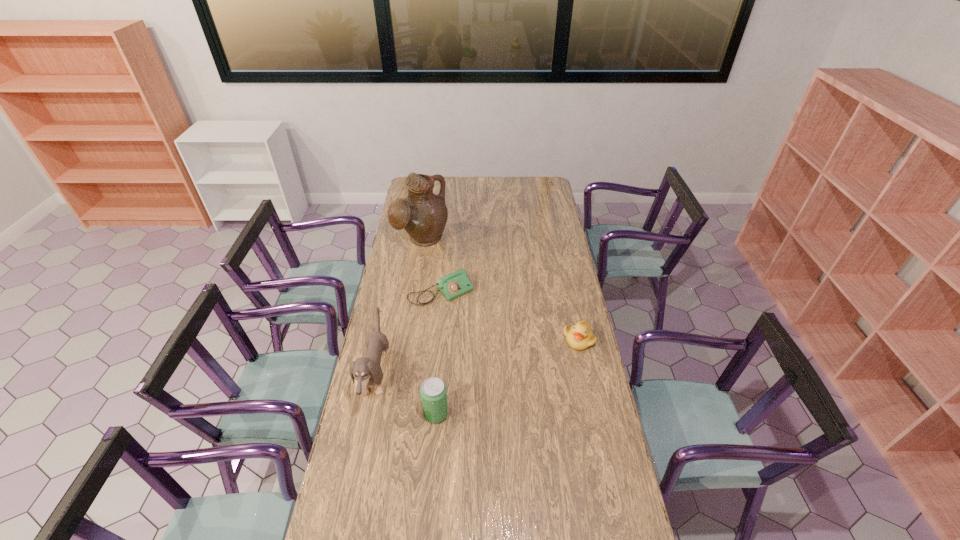
This screenshot has height=540, width=960. I want to click on vacant space that is in between the third tallest object and the fourth tallest object, so click(507, 376).

At what (x,y) coordinates should I click in order to perform the action: click on vacant space that is in between the third tallest object and the farthest object. Please return your answer as a coordinate pair (x, y). The width and height of the screenshot is (960, 540). Looking at the image, I should click on (429, 327).

Find the location of a particular element. This screenshot has width=960, height=540. unoccupied area between the farthest object and the second farthest object is located at coordinates (432, 267).

At what (x,y) coordinates should I click in order to perform the action: click on free space between the pitcher and the shortest object. Please return your answer as a coordinate pair (x, y). Looking at the image, I should click on (432, 267).

What are the coordinates of `vacant area that lies between the puppy and the fourth tallest object` in the screenshot? It's located at (477, 358).

The image size is (960, 540). I want to click on vacant area between the puppy and the tallest object, so click(x=398, y=308).

In order to click on free space between the second tallest object and the shortest object in this screenshot , I will do `click(409, 335)`.

Find the location of `object that is the second closest to the fourth tallest object`. object that is the second closest to the fourth tallest object is located at coordinates click(433, 392).

At what (x,y) coordinates should I click in order to perform the action: click on the fourth closest object relative to the fourth shortest object. Please return your answer as a coordinate pair (x, y). The height and width of the screenshot is (540, 960). Looking at the image, I should click on (579, 337).

Where is `vacant area that satisfies the following two spatial constraints: 1. on the front side of the shortest object; 2. on the right side of the pitcher`? Image resolution: width=960 pixels, height=540 pixels. vacant area that satisfies the following two spatial constraints: 1. on the front side of the shortest object; 2. on the right side of the pitcher is located at coordinates (413, 293).